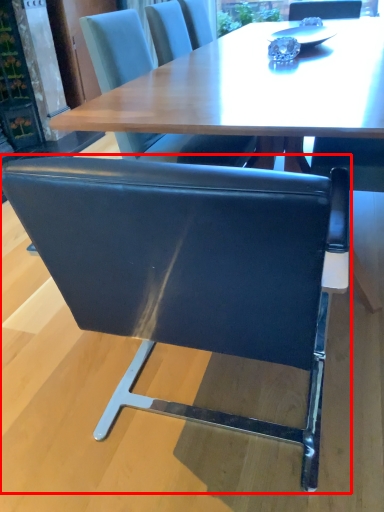
Question: Where is chair (annotated by the red box) located in relation to chair in the image?

Choices:
 (A) left
 (B) right

Answer: (A)